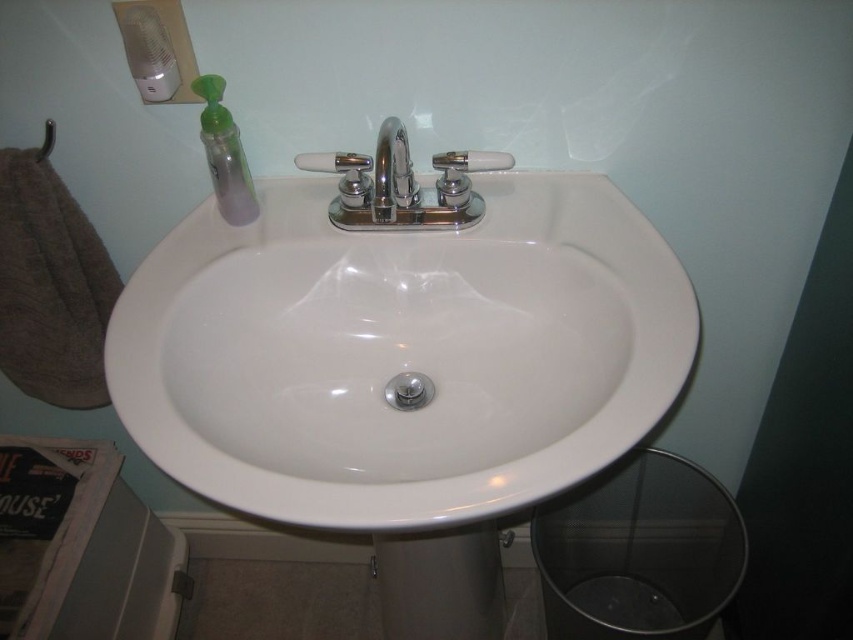
Which is below, white glossy sink at center or translucent plastic soap at upper center?

white glossy sink at center is below.

Is white glossy sink at center to the left of translucent plastic soap at upper center from the viewer's perspective?

No, white glossy sink at center is not to the left of translucent plastic soap at upper center.

Where is `white glossy sink at center`? This screenshot has height=640, width=853. white glossy sink at center is located at coordinates (401, 353).

This screenshot has height=640, width=853. In order to click on white glossy sink at center in this screenshot , I will do `click(401, 353)`.

Is white glossy sink at center behind white frosted glass soap at center?

No.

Does white glossy sink at center appear over white frosted glass soap at center?

No, white glossy sink at center is not above white frosted glass soap at center.

This screenshot has height=640, width=853. I want to click on white glossy sink at center, so [401, 353].

Based on the photo, is matte plastic soap dispenser at upper left positioned behind white frosted glass soap at center?

That is False.

Does matte plastic soap dispenser at upper left appear on the left side of white frosted glass soap at center?

Indeed, matte plastic soap dispenser at upper left is positioned on the left side of white frosted glass soap at center.

What do you see at coordinates (148, 51) in the screenshot? I see `matte plastic soap dispenser at upper left` at bounding box center [148, 51].

Image resolution: width=853 pixels, height=640 pixels. I want to click on matte plastic soap dispenser at upper left, so click(148, 51).